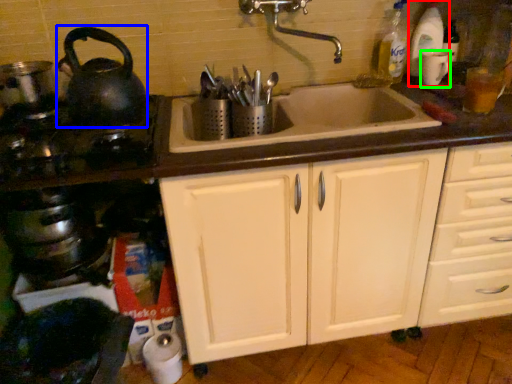
Question: Based on their relative distances, which object is nearer to bottle (highlighted by a red box)? Choose from tea pot (highlighted by a blue box) and appliance (highlighted by a green box).

Choices:
 (A) tea pot
 (B) appliance

Answer: (B)